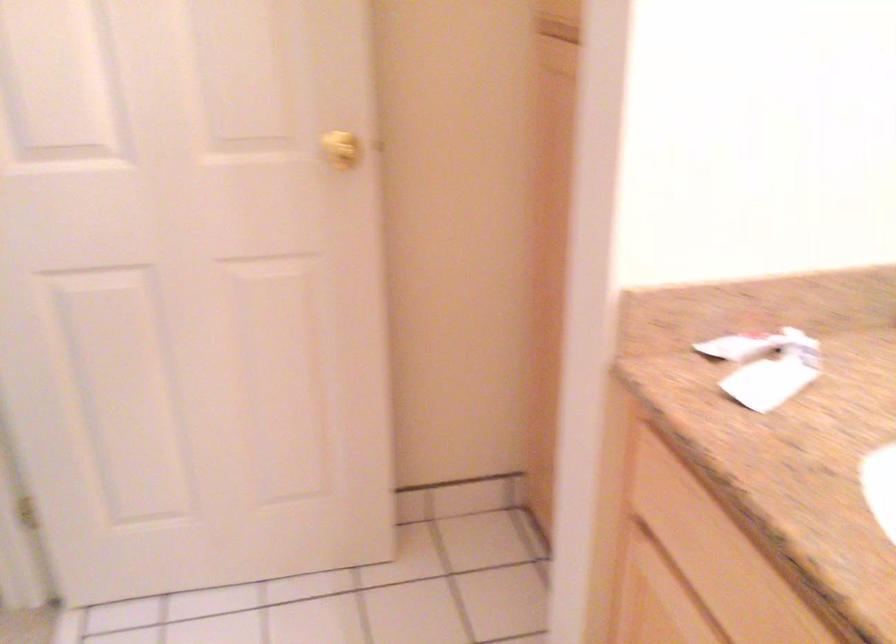
Find where to turn the gold door knob. Please return your answer as a coordinate pair (x, y).

(340, 149)